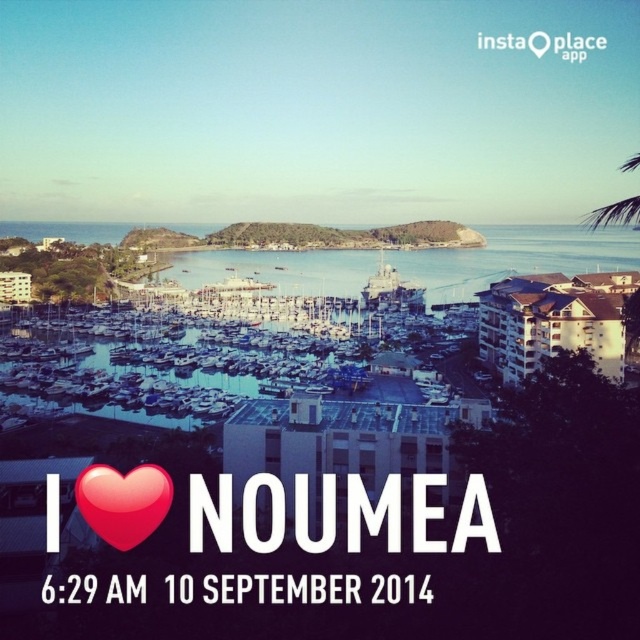
What do you see at coordinates (515, 257) in the screenshot? The width and height of the screenshot is (640, 640). I see `blue water at center` at bounding box center [515, 257].

Is point (285, 273) positioned in front of point (106, 536)?

No, (285, 273) is further to viewer.

Identify the location of blue water at center. (515, 257).